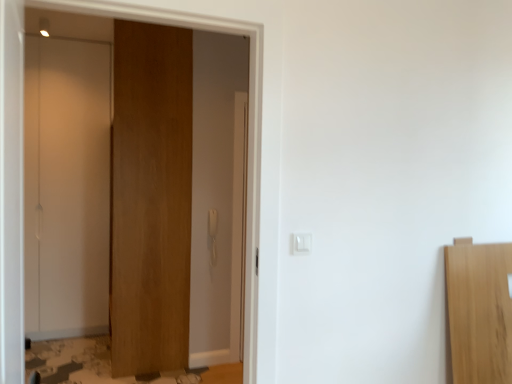
Question: Can you confirm if white plastic light switch at center is wider than wooden door at center, arranged as the first door when viewed from the right?

Choices:
 (A) yes
 (B) no

Answer: (B)

Question: Are white plastic light switch at center and wooden door at center, the second door from the left, beside each other?

Choices:
 (A) yes
 (B) no

Answer: (B)

Question: From a real-world perspective, does white plastic light switch at center sit lower than wooden door at center, the second door from the left?

Choices:
 (A) yes
 (B) no

Answer: (A)

Question: Does white plastic light switch at center appear on the left side of wooden door at center, the second door from the left?

Choices:
 (A) no
 (B) yes

Answer: (A)

Question: Can you confirm if white plastic light switch at center is thinner than wooden door at center, arranged as the first door when viewed from the right?

Choices:
 (A) yes
 (B) no

Answer: (A)

Question: Is white plastic light switch at center far away from wooden door at center, arranged as the first door when viewed from the right?

Choices:
 (A) no
 (B) yes

Answer: (B)

Question: Is wooden door at center, the second door from the left, next to white plastic light switch at center?

Choices:
 (A) no
 (B) yes

Answer: (A)

Question: Can you confirm if wooden door at center, the second door from the left, is wider than white plastic light switch at center?

Choices:
 (A) yes
 (B) no

Answer: (A)

Question: Considering the relative sizes of wooden door at center, the second door from the left, and white plastic light switch at center in the image provided, is wooden door at center, the second door from the left, thinner than white plastic light switch at center?

Choices:
 (A) yes
 (B) no

Answer: (B)

Question: Is white plastic light switch at center a part of wooden door at center, the second door from the left?

Choices:
 (A) no
 (B) yes

Answer: (A)

Question: Is wooden door at center, arranged as the first door when viewed from the right, facing away from white plastic light switch at center?

Choices:
 (A) no
 (B) yes

Answer: (A)

Question: From a real-world perspective, is wooden door at center, arranged as the first door when viewed from the right, positioned over white plastic light switch at center based on gravity?

Choices:
 (A) no
 (B) yes

Answer: (B)

Question: Is white glossy door at left, the second door viewed from the right, facing towards white plastic light switch at center?

Choices:
 (A) no
 (B) yes

Answer: (A)